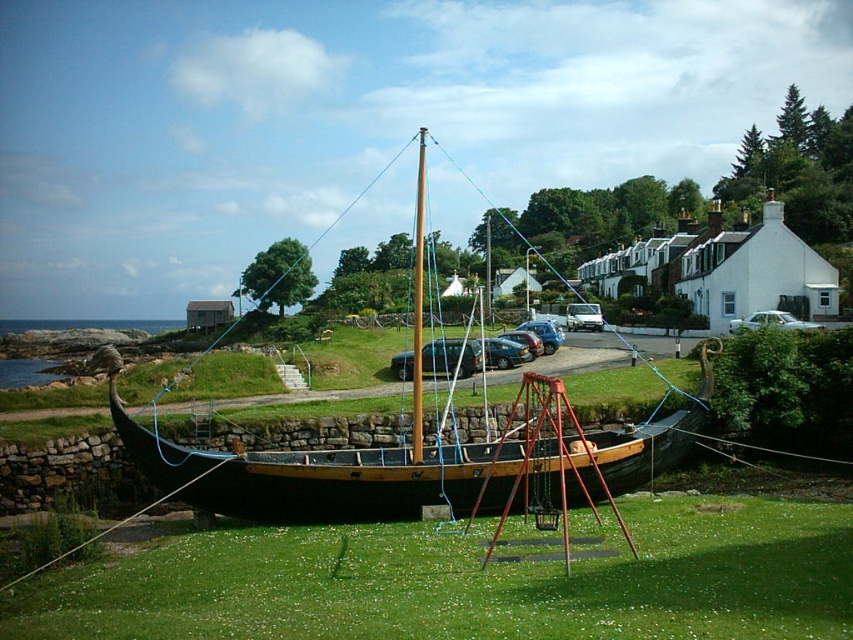
Question: Which point is closer to the camera taking this photo?

Choices:
 (A) (322, 452)
 (B) (796, 326)
 (C) (416, 337)

Answer: (A)

Question: Which object is positioned closest to the white matte sedan at center?

Choices:
 (A) green grass at lower center
 (B) wooden mast at center
 (C) wooden sailboat at center

Answer: (C)

Question: Is wooden mast at center smaller than white matte sedan at center?

Choices:
 (A) yes
 (B) no

Answer: (B)

Question: Which of the following is the farthest from the observer?

Choices:
 (A) white matte sedan at center
 (B) wooden mast at center
 (C) green grass at lower center
 (D) wooden sailboat at center

Answer: (A)

Question: Does green grass at lower center appear on the left side of white matte sedan at center?

Choices:
 (A) yes
 (B) no

Answer: (A)

Question: Does green grass at lower center come in front of wooden sailboat at center?

Choices:
 (A) yes
 (B) no

Answer: (A)